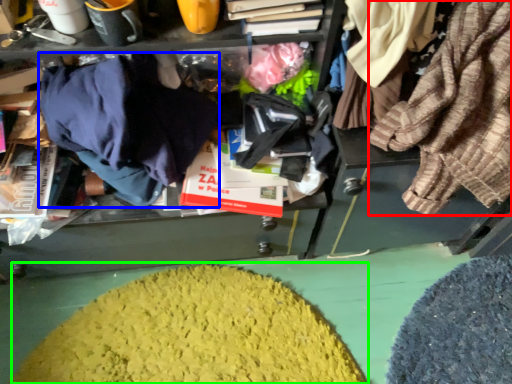
Question: Based on their relative distances, which object is farther from clothing (highlighted by a red box)? Choose from clothing (highlighted by a blue box) and debris (highlighted by a green box).

Choices:
 (A) clothing
 (B) debris

Answer: (B)